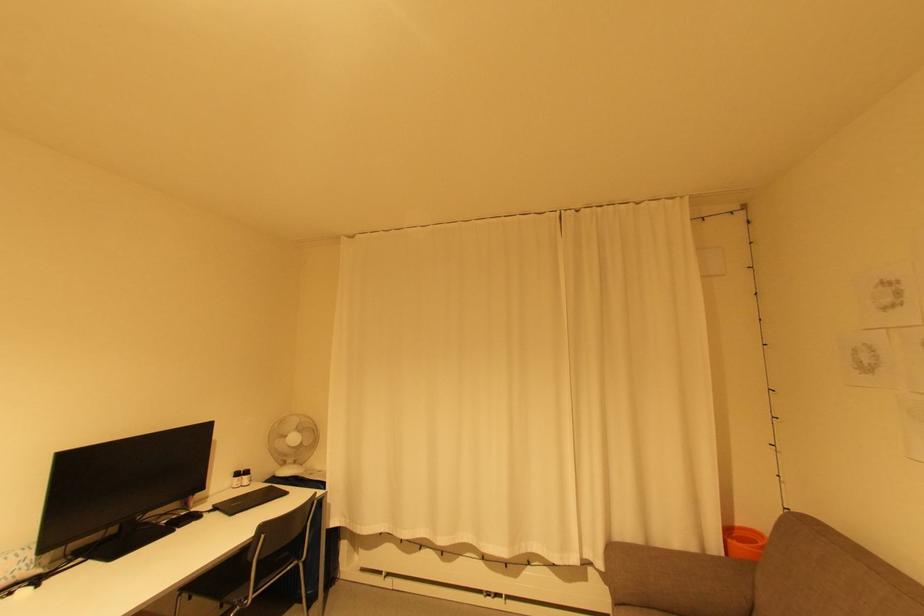
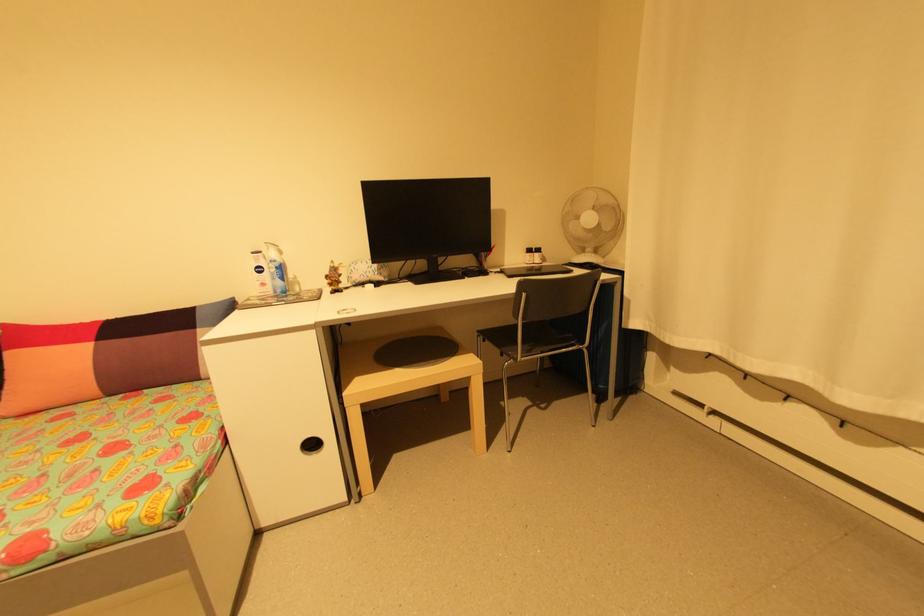
Where in the second image is the point corresponding to point 301,565 from the first image?

(585, 352)